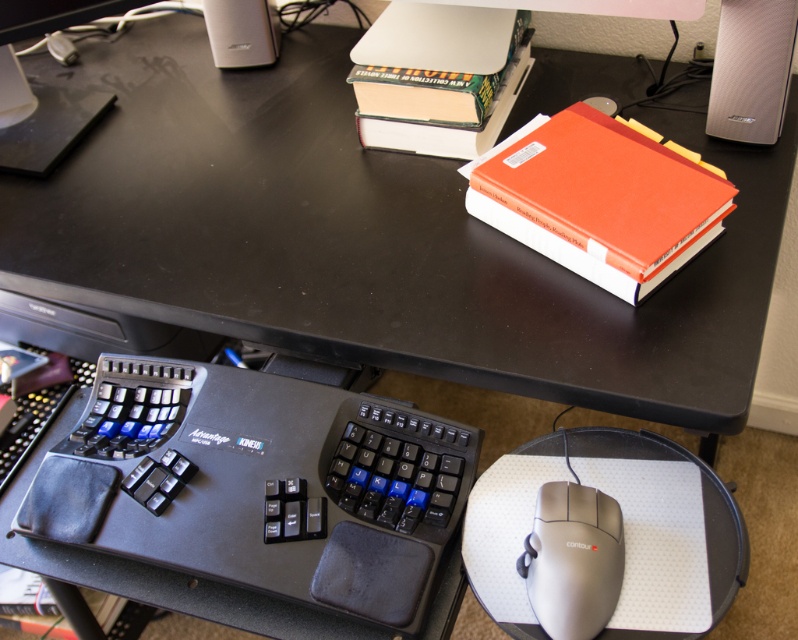
Can you confirm if black rubberized keyboard at lower left is positioned below matte black speaker at upper left?

Indeed, black rubberized keyboard at lower left is positioned under matte black speaker at upper left.

Who is higher up, black rubberized keyboard at lower left or matte black speaker at upper left?

matte black speaker at upper left

Who is more forward, [377,435] or [223,36]?

Point [377,435] is more forward.

Locate an element on the screen. black rubberized keyboard at lower left is located at coordinates (255, 500).

Does orange matte book at upper right appear under satin silver mouse at lower right?

No.

Is point (522, 132) in front of point (591, 518)?

No, (522, 132) is behind (591, 518).

Does point (538, 244) come behind point (551, 573)?

Yes.

Locate an element on the screen. orange matte book at upper right is located at coordinates (599, 198).

Who is positioned more to the right, black rubberized keyboard at lower left or orange matte book at upper right?

Positioned to the right is orange matte book at upper right.

Is black rubberized keyboard at lower left to the left of orange matte book at upper right from the viewer's perspective?

Correct, you'll find black rubberized keyboard at lower left to the left of orange matte book at upper right.

What do you see at coordinates (255, 500) in the screenshot? I see `black rubberized keyboard at lower left` at bounding box center [255, 500].

This screenshot has width=798, height=640. What are the coordinates of `black rubberized keyboard at lower left` in the screenshot? It's located at (255, 500).